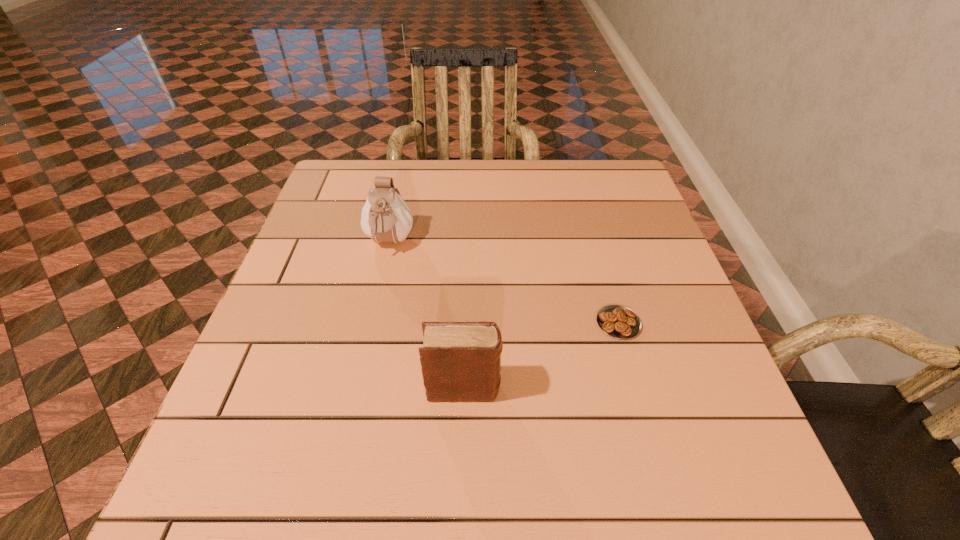
This screenshot has width=960, height=540. What are the coordinates of `object present at the right edge` in the screenshot? It's located at (617, 321).

Identify the location of vacant region at the far edge of the desktop. (505, 167).

Where is `vacant space at the left edge of the desktop`? vacant space at the left edge of the desktop is located at coordinates (312, 373).

At what (x,y) coordinates should I click in order to perform the action: click on vacant space at the right edge of the desktop. Please return your answer as a coordinate pair (x, y). Looking at the image, I should click on (690, 333).

The height and width of the screenshot is (540, 960). Find the location of `vacant space at the far left corner`. vacant space at the far left corner is located at coordinates (338, 160).

Locate an element on the screen. vacant space at the near right corner of the desktop is located at coordinates (667, 498).

I want to click on free space between the second object from left to right and the rightmost object, so click(x=541, y=356).

You are a GUI agent. You are given a task and a screenshot of the screen. Output one action in this format:
    pyautogui.click(x=<x>, y=<y>)
    Task: Click on the vacant space in between the leftmost object and the nearest object
    
    Given the screenshot: What is the action you would take?
    pyautogui.click(x=426, y=316)

Identify the location of vacant point located between the pastry and the diary. This screenshot has width=960, height=540. (541, 356).

Locate an element on the screen. This screenshot has height=540, width=960. free space that is in between the diary and the leftmost object is located at coordinates (426, 316).